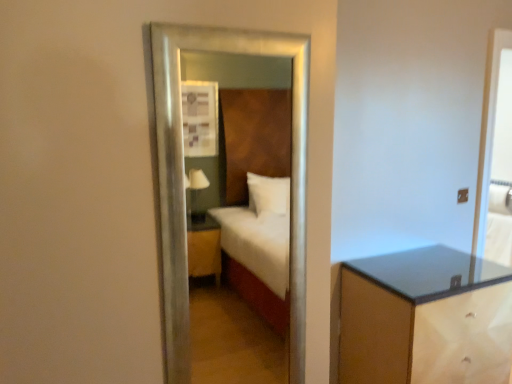
Where is `empty space that is ontop of silver metallic mirror at center (from a real-world perspective)`? This screenshot has height=384, width=512. empty space that is ontop of silver metallic mirror at center (from a real-world perspective) is located at coordinates (225, 23).